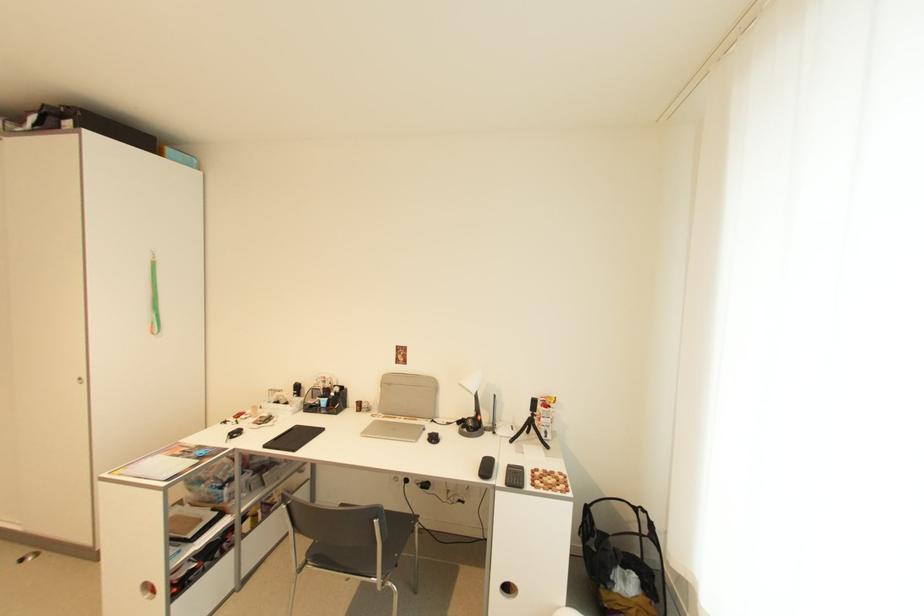
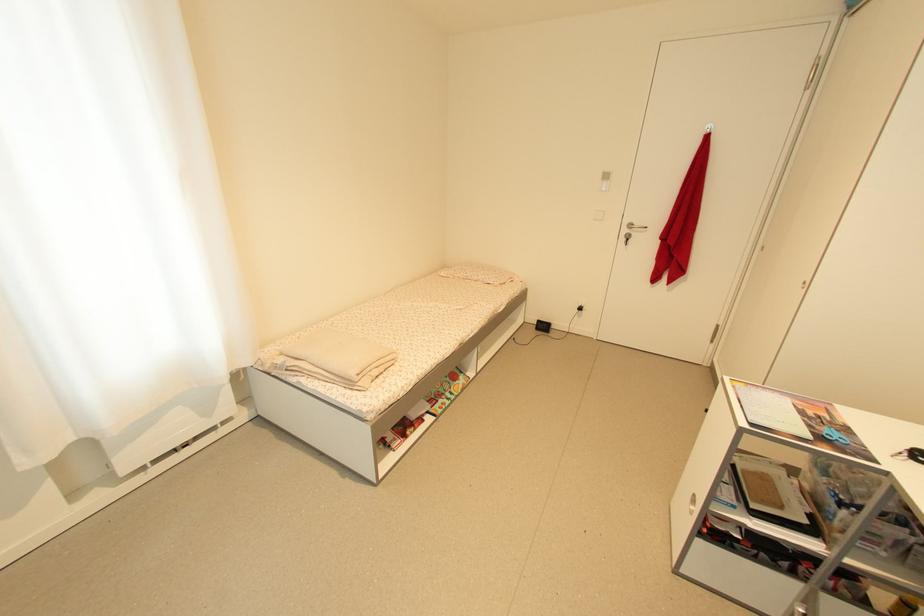
How did the camera likely rotate?

The camera's rotation is toward left-down.